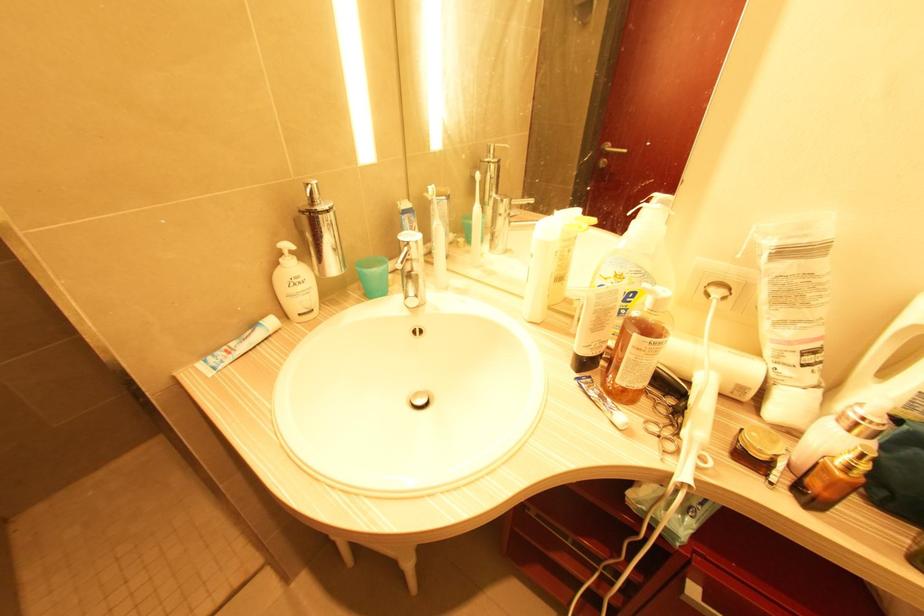
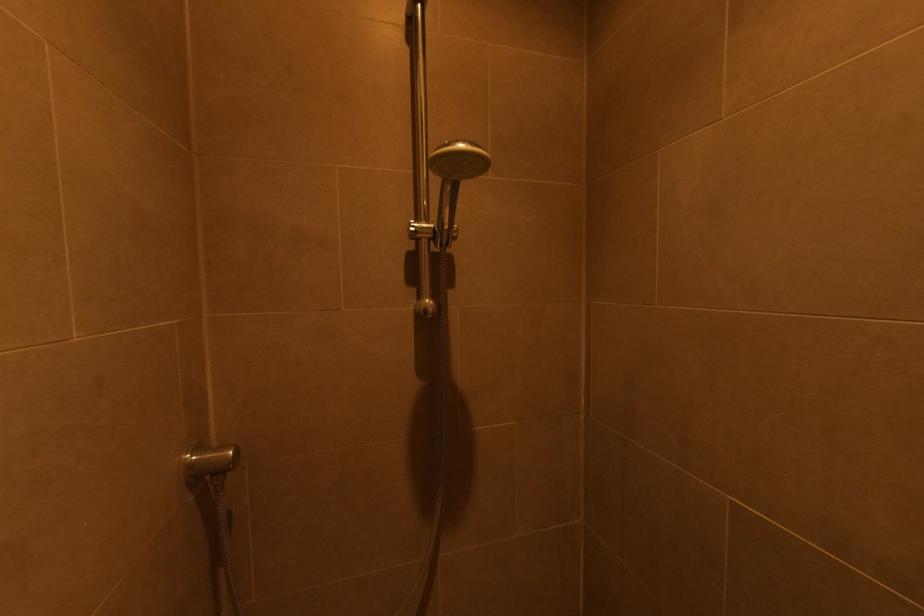
Question: I am providing you with two images of the same scene from different viewpoints. Which of the following objects are not visible in image2?

Choices:
 (A) handheld shower head
 (B) pink pillow
 (C) shower holder adjuster
 (D) electric toothbrush

Answer: (D)